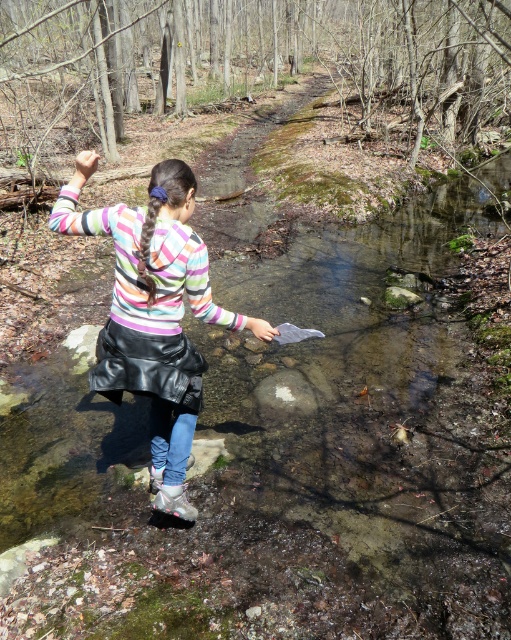
The young girl is wearing a leather skirt at center and a matte gray boot at lower center. Which item is taller?

The leather skirt at center is taller than the matte gray boot at lower center.

You are a photographer trying to capture the girl in the scene. If you want to focus on the leather skirt at center, which is located at point 0.480 in the x coordinate and 0.301 in the y coordinate, where should you aim your camera? Please provide the coordinates in the format of x,y.

The leather skirt at center is positioned at coordinates [153,307], so you should aim your camera at that exact point to focus on it.

The girl is standing in the stream. Can you tell me how the leather skirt at center and the matte gray boot at lower center are positioned relative to each other?

The leather skirt at center is positioned over the matte gray boot at lower center.